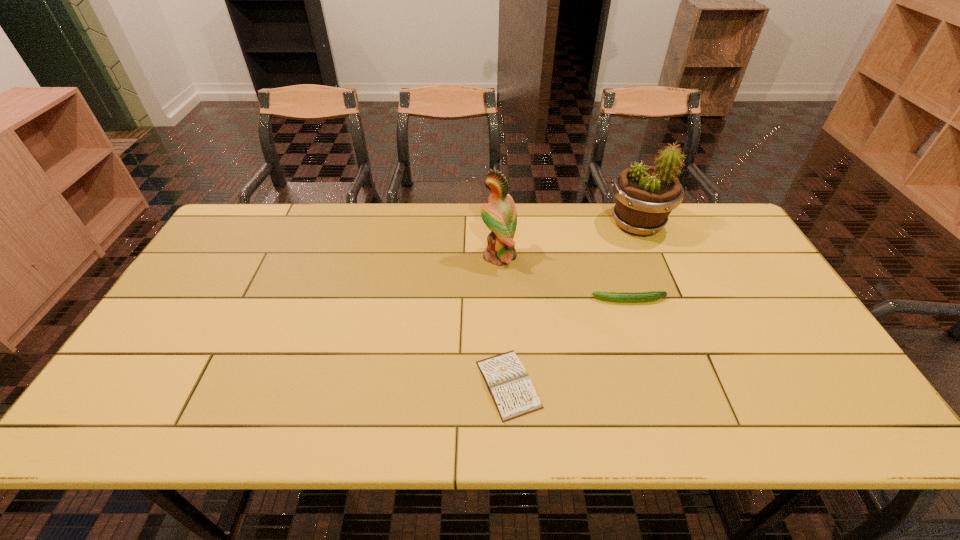
In order to click on flowerpot in this screenshot , I will do 645,195.

Identify the location of parrot. (499, 214).

Locate an element on the screen. the third farthest object is located at coordinates (654, 295).

You are a GUI agent. You are given a task and a screenshot of the screen. Output one action in this format:
    pyautogui.click(x=<x>, y=<y>)
    Task: Click on the third tallest object
    
    Given the screenshot: What is the action you would take?
    pyautogui.click(x=654, y=295)

The width and height of the screenshot is (960, 540). In order to click on diary in this screenshot , I will do `click(514, 395)`.

The width and height of the screenshot is (960, 540). Identify the location of the nearest object. (514, 395).

Where is `vacant space located 0.240m on the left of the flowerpot`? vacant space located 0.240m on the left of the flowerpot is located at coordinates (533, 224).

Where is `blank space located on the front-facing side of the parrot`? This screenshot has height=540, width=960. blank space located on the front-facing side of the parrot is located at coordinates (464, 256).

Find the location of a particular element. free space located on the front-facing side of the parrot is located at coordinates (383, 256).

This screenshot has width=960, height=540. In order to click on free spot located on the front-facing side of the parrot in this screenshot , I will do `click(360, 256)`.